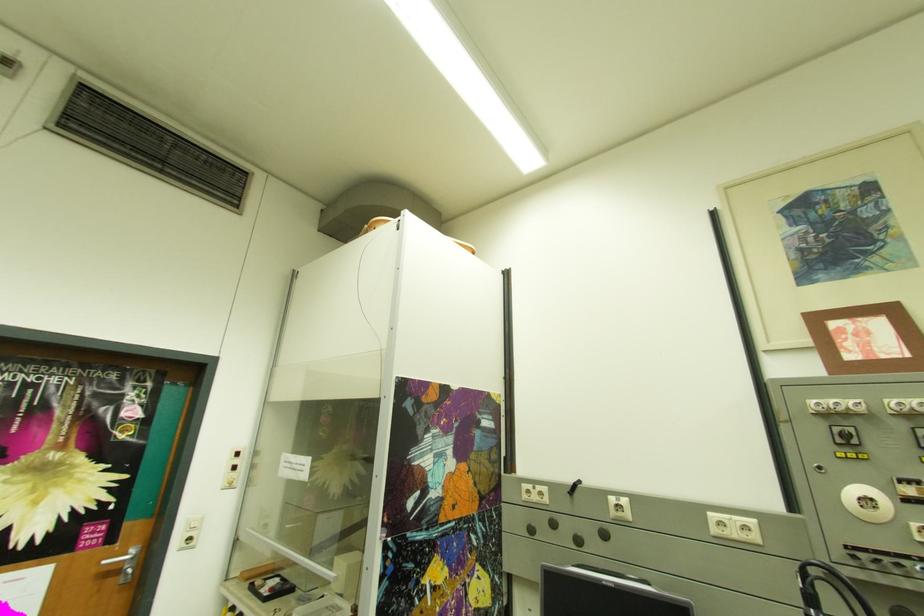
The image size is (924, 616). Describe the element at coordinates (125, 562) in the screenshot. I see `the silver door handle` at that location.